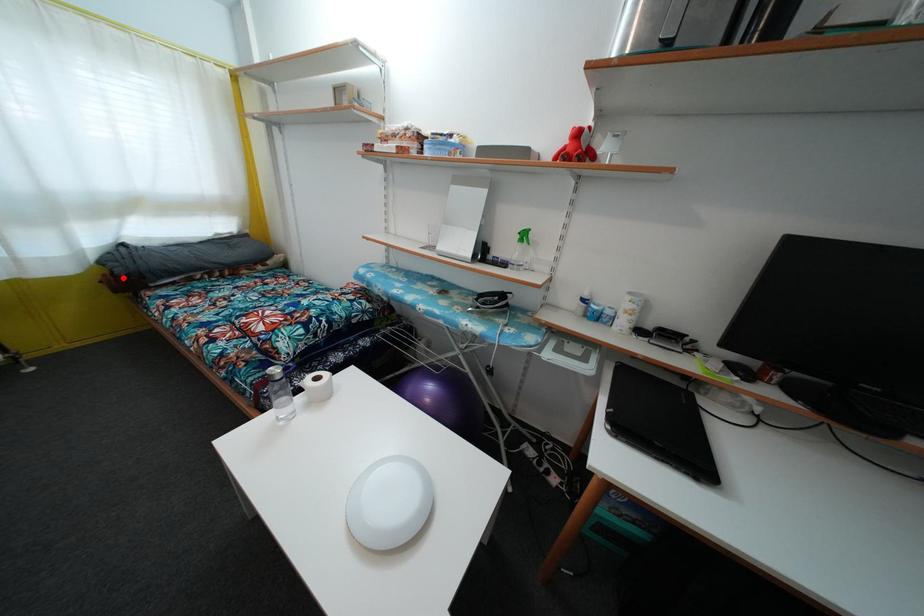
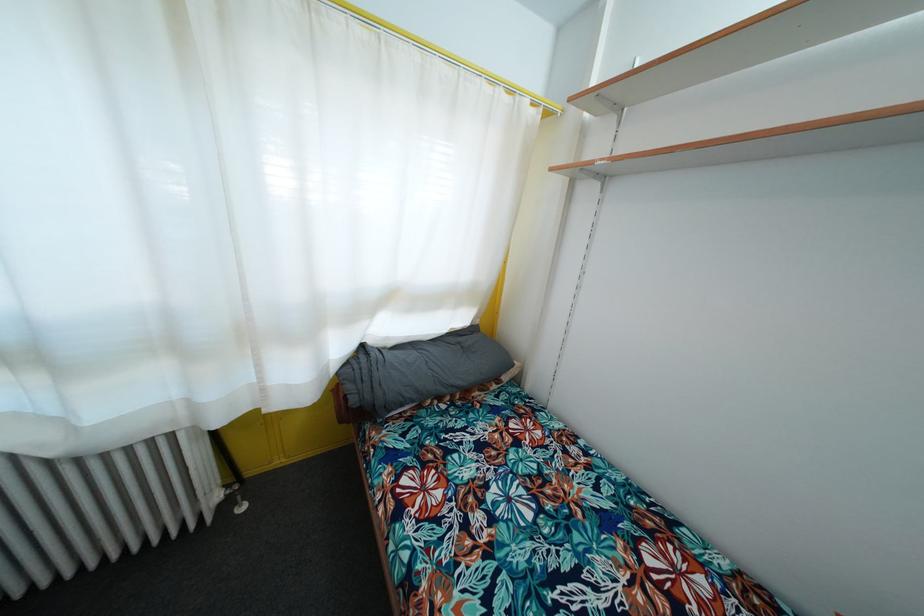
Locate, in the second image, the point that corresponds to the highlighted location in the first image.

(358, 407)